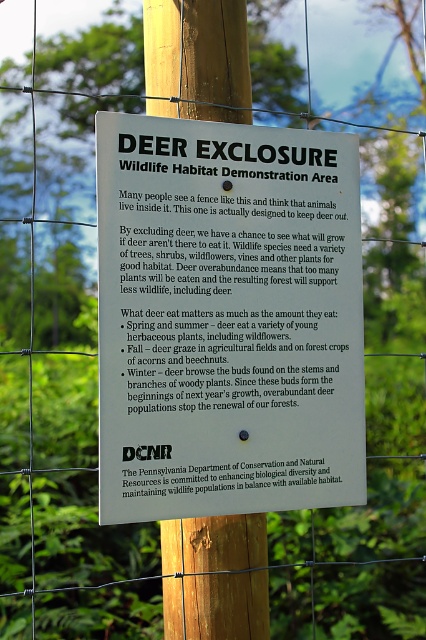
Can you confirm if white paper sign at center is positioned below wooden post at center?

Actually, white paper sign at center is above wooden post at center.

Is white paper sign at center to the right of wooden post at center from the viewer's perspective?

Yes, white paper sign at center is to the right of wooden post at center.

Looking at this image, who is more forward, (301, 396) or (215, 602)?

Point (301, 396) is more forward.

The width and height of the screenshot is (426, 640). I want to click on white paper sign at center, so click(x=227, y=317).